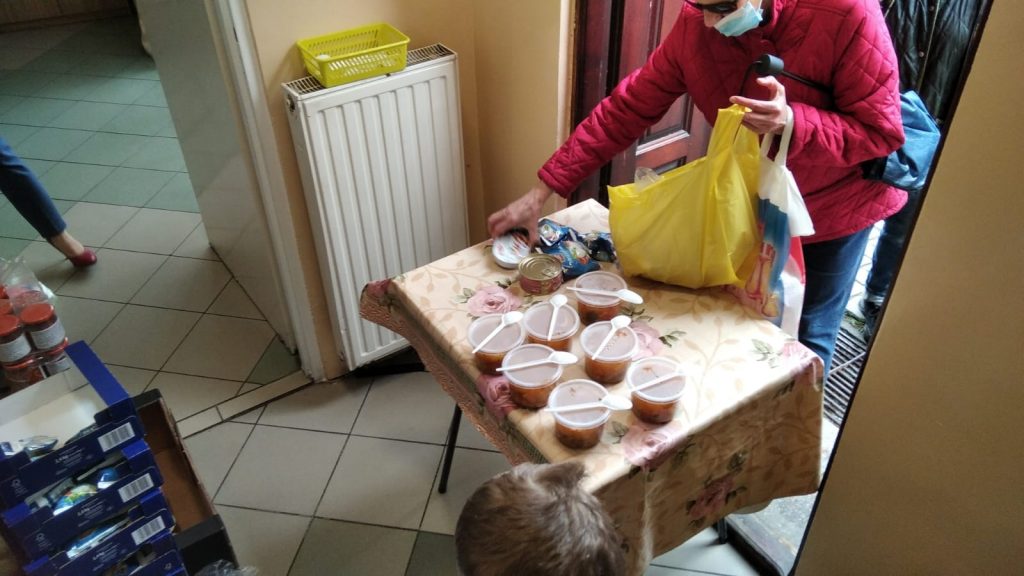
The height and width of the screenshot is (576, 1024). Find the location of `spoons`. spoons is located at coordinates (602, 401), (555, 358), (615, 321), (625, 298), (553, 300), (512, 321), (671, 373).